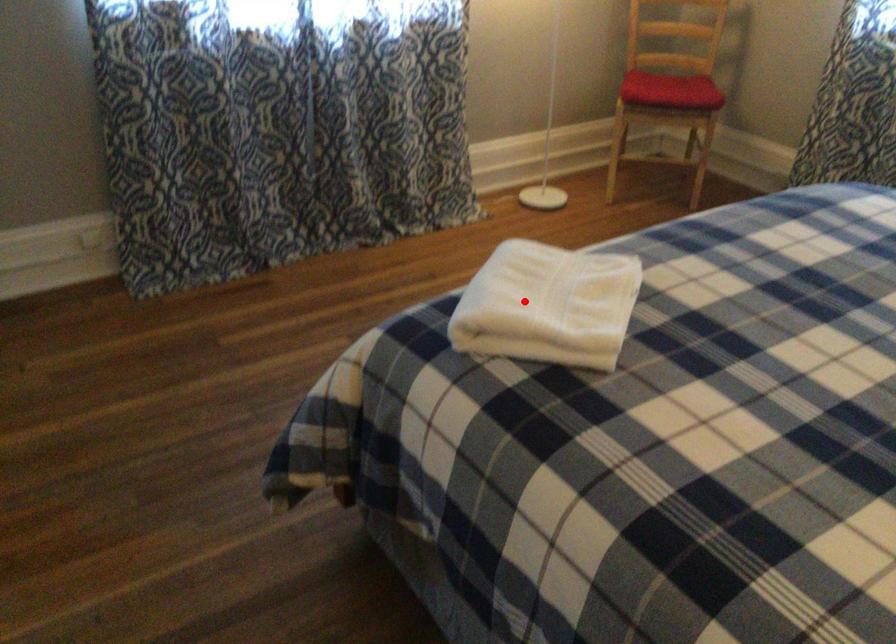
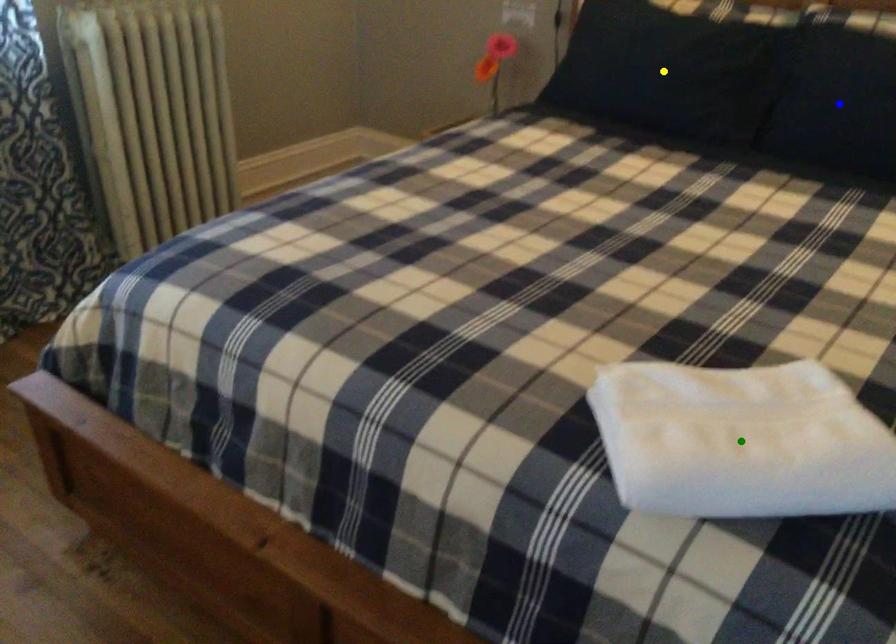
Question: I am providing you with two images of the same scene from different viewpoints. A red point is marked on the first image. You are given multiple points on the second image. Which point in image 2 is actually the same real-world point as the red point in image 1?

Choices:
 (A) green point
 (B) yellow point
 (C) blue point

Answer: (A)